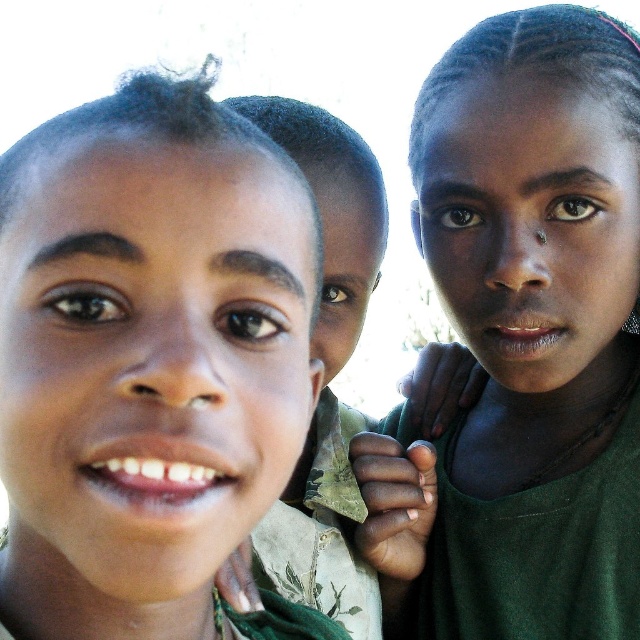
Question: Is dark green fabric at upper right below camouflage fabric shirt at center?

Choices:
 (A) yes
 (B) no

Answer: (B)

Question: Among these objects, which one is farthest from the camera?

Choices:
 (A) camouflage fabric shirt at center
 (B) matte green shirt at left
 (C) dark green fabric at upper right

Answer: (C)

Question: Which object appears closest to the camera in this image?

Choices:
 (A) dark green fabric at upper right
 (B) matte green shirt at left
 (C) camouflage fabric shirt at center

Answer: (B)

Question: Based on their relative distances, which object is nearer to the dark green fabric at upper right?

Choices:
 (A) camouflage fabric shirt at center
 (B) matte green shirt at left

Answer: (A)

Question: Does matte green shirt at left appear on the left side of camouflage fabric shirt at center?

Choices:
 (A) no
 (B) yes

Answer: (B)

Question: Is dark green fabric at upper right above camouflage fabric shirt at center?

Choices:
 (A) no
 (B) yes

Answer: (B)